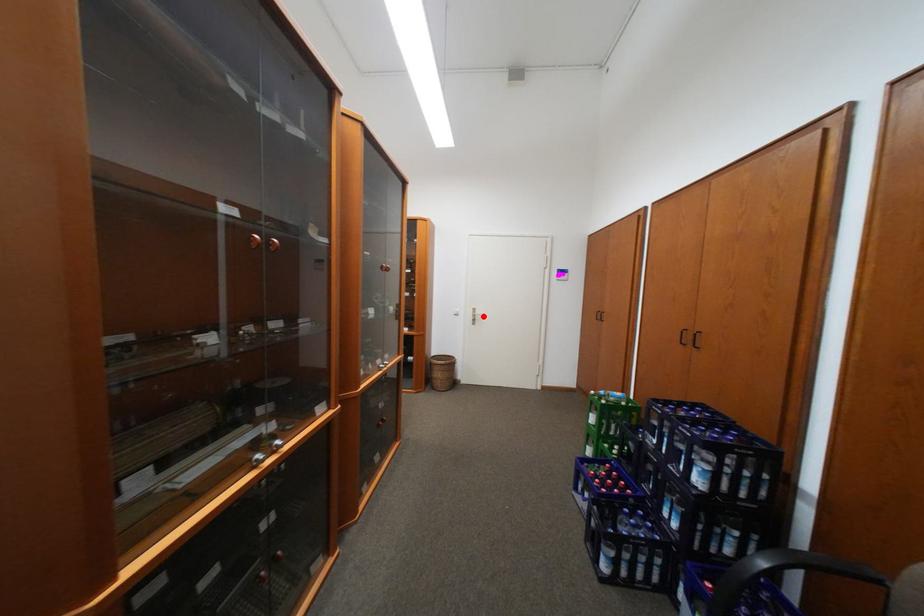
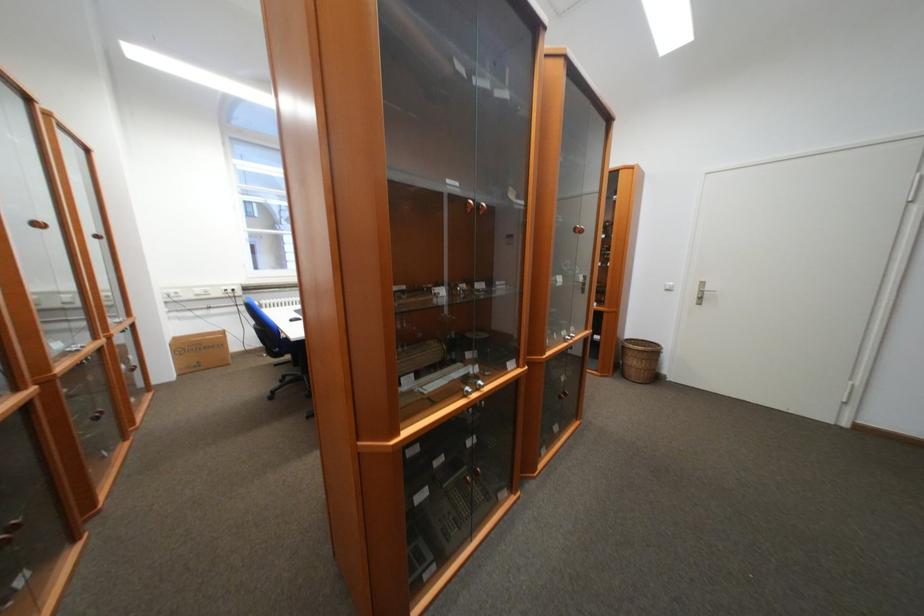
In the second image, find the point that corresponds to the highlighted location in the first image.

(711, 293)